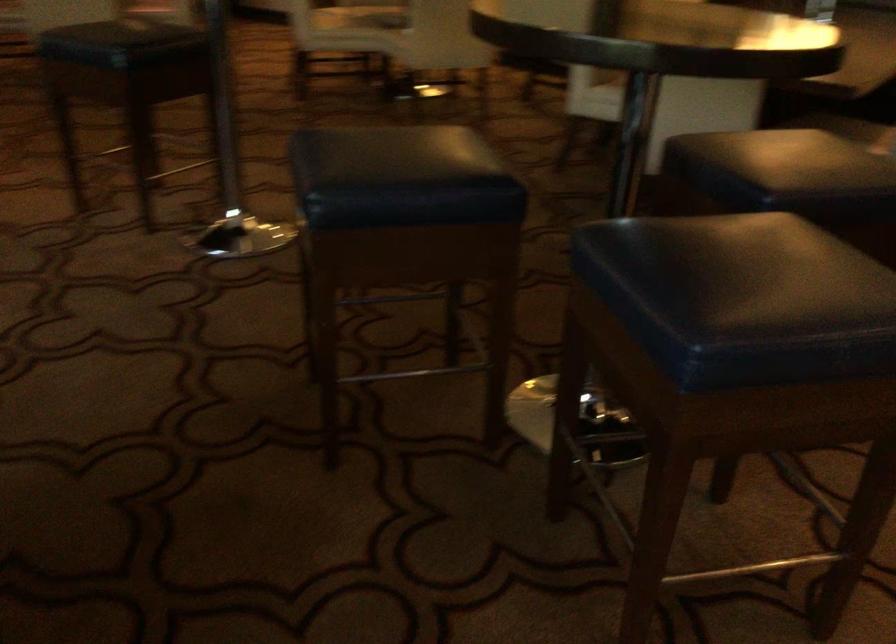
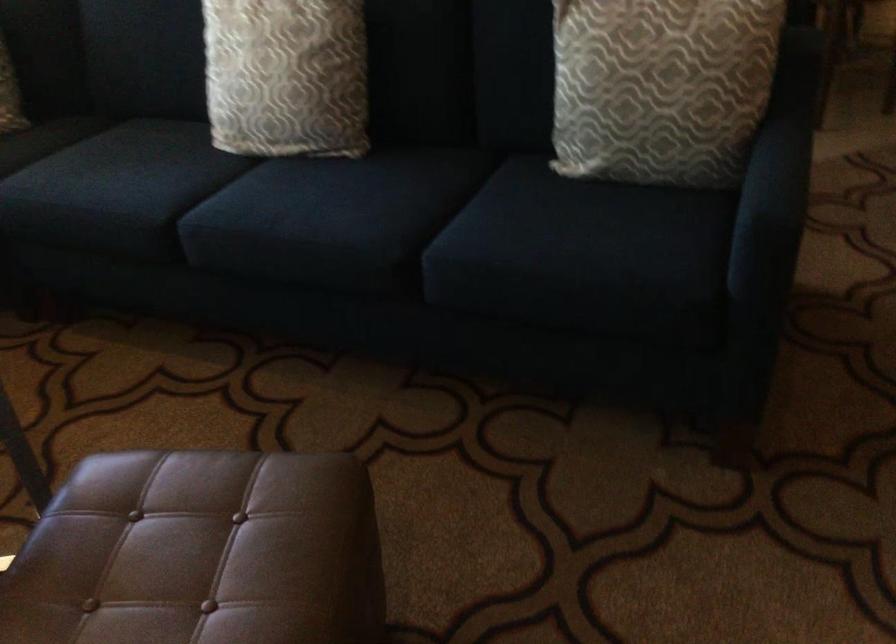
How did the camera likely rotate?

The camera's rotation is toward left-down.